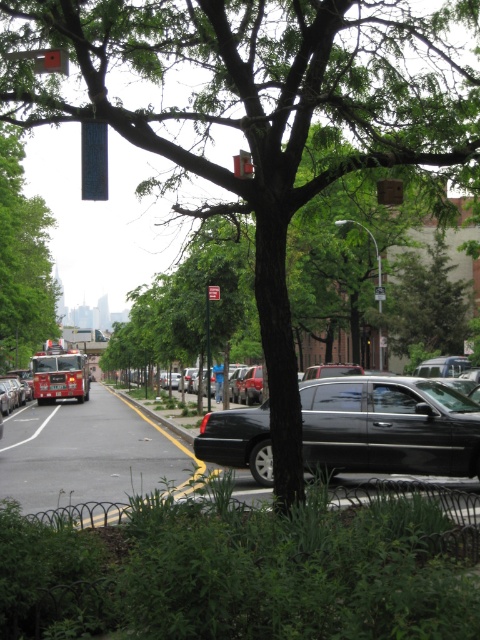
Question: Which object appears farthest from the camera in this image?

Choices:
 (A) green leafy tree at center
 (B) metallic rectangular at upper center
 (C) brushed metal fire truck at left

Answer: (C)

Question: Is green leafy tree at center wider than metallic rectangular at upper center?

Choices:
 (A) no
 (B) yes

Answer: (B)

Question: Among these points, which one is nearest to the camera?

Choices:
 (A) (22, 193)
 (B) (248, 164)
 (C) (456, 472)

Answer: (B)

Question: Does green leafy tree at center appear under brushed metal fire truck at left?

Choices:
 (A) no
 (B) yes

Answer: (A)

Question: Which of the following is the farthest from the observer?

Choices:
 (A) (8, 198)
 (B) (252, 166)

Answer: (A)

Question: Does glossy black sedan at center appear over metallic rectangular at upper center?

Choices:
 (A) yes
 (B) no

Answer: (B)